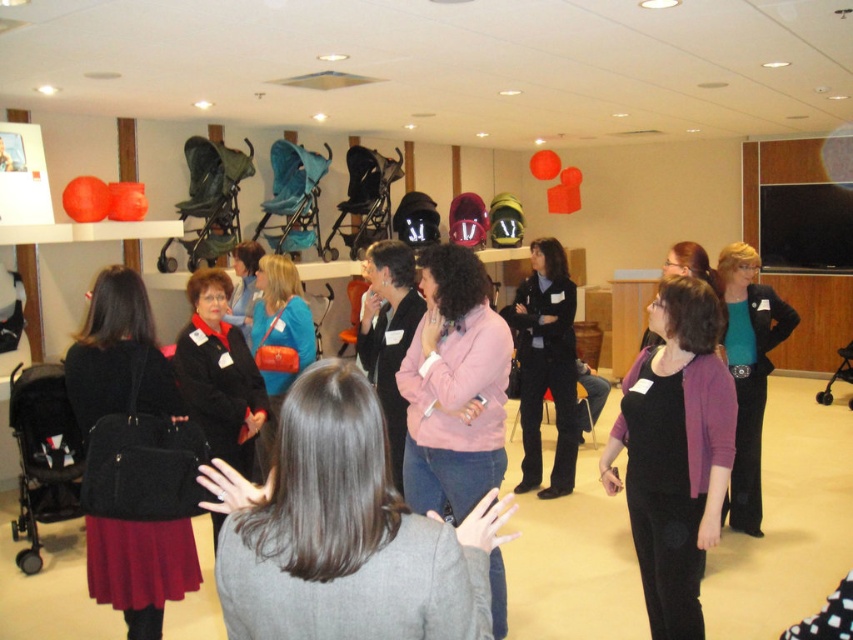
Is the position of matte orange purse at center less distant than that of matte black sweater at center?

No, matte orange purse at center is further to the viewer.

Can you confirm if matte orange purse at center is thinner than matte black sweater at center?

Incorrect, matte orange purse at center's width is not less than matte black sweater at center's.

Image resolution: width=853 pixels, height=640 pixels. I want to click on matte orange purse at center, so click(x=280, y=326).

Does purple matte cardigan at center appear on the right side of matte orange purse at center?

Indeed, purple matte cardigan at center is positioned on the right side of matte orange purse at center.

Can you confirm if purple matte cardigan at center is positioned below matte orange purse at center?

Yes, purple matte cardigan at center is below matte orange purse at center.

Which is in front, point (689, 492) or point (262, 300)?

Point (689, 492)

This screenshot has height=640, width=853. I want to click on purple matte cardigan at center, so [x=675, y=452].

Measure the distance between point (113,321) and camera.

They are 9.26 feet apart.

Who is lower down, velvet black purse at lower left or matte black sweater at center?

velvet black purse at lower left

What do you see at coordinates (119, 355) in the screenshot? This screenshot has height=640, width=853. I see `velvet black purse at lower left` at bounding box center [119, 355].

Identify the location of velvet black purse at lower left. The height and width of the screenshot is (640, 853). (119, 355).